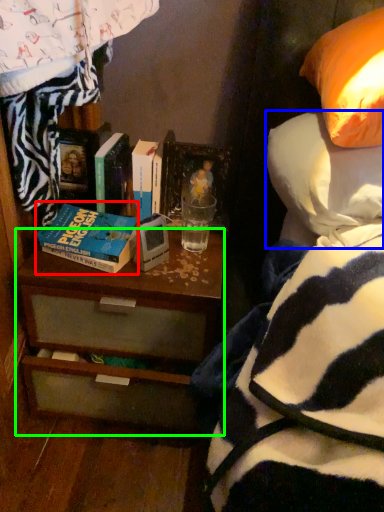
Question: Estimate the real-world distances between objects in this image. Which object is farther from book (highlighted by a red box), pillow (highlighted by a blue box) or desk (highlighted by a green box)?

Choices:
 (A) pillow
 (B) desk

Answer: (A)